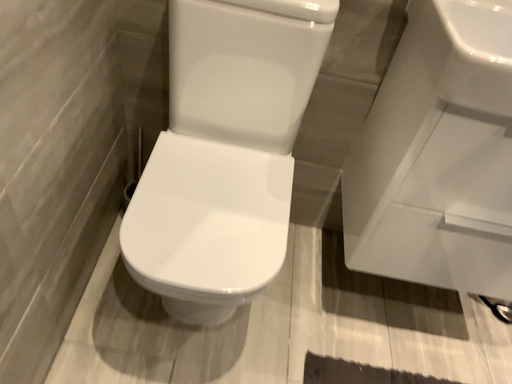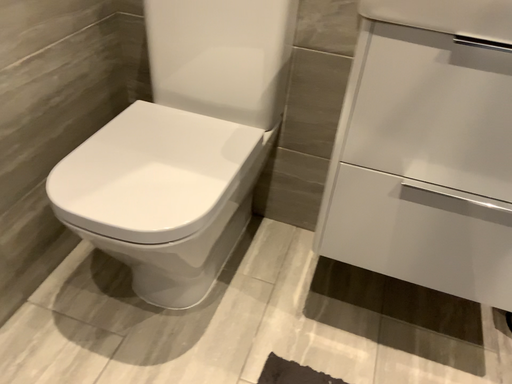
Question: Which way did the camera rotate in the video?

Choices:
 (A) rotated left
 (B) rotated right

Answer: (A)